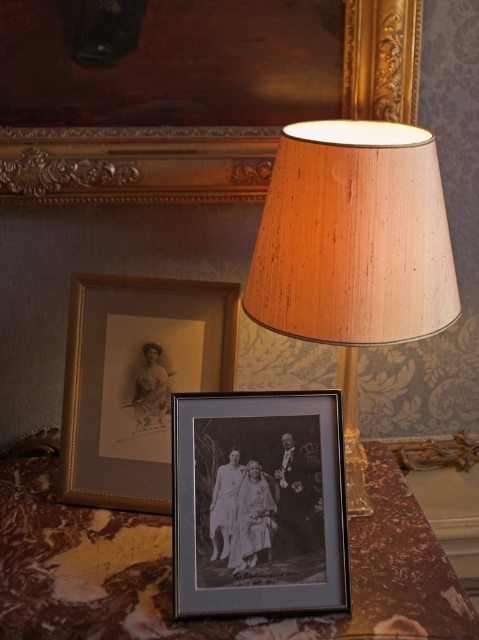
Is point (206, 627) closer to camera compared to point (449, 256)?

Yes, point (206, 627) is closer to viewer.

Does marble table at center have a smaller size compared to wooden lampshade at upper center?

No, marble table at center is not smaller than wooden lampshade at upper center.

Does point (73, 612) come in front of point (435, 321)?

That is True.

At what (x,y) coordinates should I click in order to perform the action: click on marble table at center. Please return your answer as a coordinate pair (x, y). This screenshot has height=640, width=479. Looking at the image, I should click on (171, 570).

Can you confirm if marble table at center is smaller than matte gold picture frame at upper center?

Actually, marble table at center might be larger than matte gold picture frame at upper center.

Does marble table at center appear over matte gold picture frame at upper center?

No, marble table at center is not above matte gold picture frame at upper center.

Which is behind, point (389, 595) or point (63, 195)?

The point (63, 195) is more distant.

Locate an element on the screen. Image resolution: width=479 pixels, height=640 pixels. marble table at center is located at coordinates (171, 570).

Can you confirm if wooden lampshade at upper center is thinner than matte gold picture frame at upper center?

Correct, wooden lampshade at upper center's width is less than matte gold picture frame at upper center's.

Does wooden lampshade at upper center appear on the right side of matte gold picture frame at upper center?

Yes, wooden lampshade at upper center is to the right of matte gold picture frame at upper center.

Which is in front, point (433, 163) or point (40, 144)?

Point (433, 163) is in front.

Image resolution: width=479 pixels, height=640 pixels. In order to click on wooden lampshade at upper center in this screenshot , I will do `click(353, 250)`.